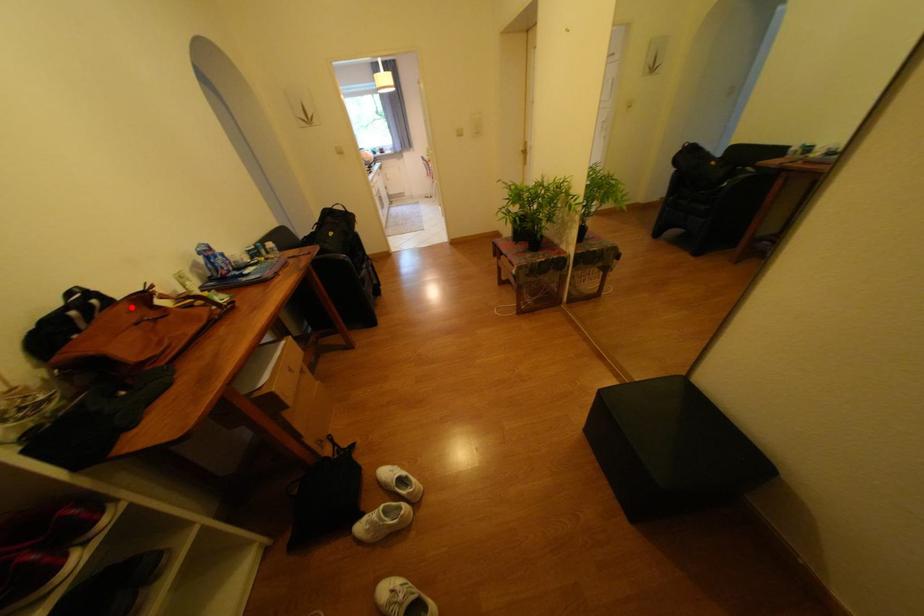
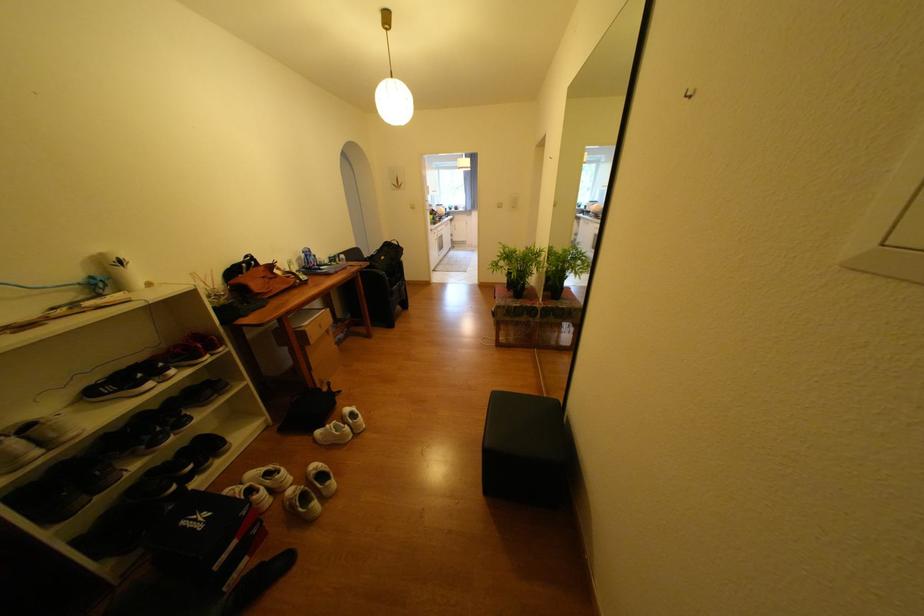
Locate, in the second image, the point that corresponds to the highlighted location in the first image.

(271, 269)